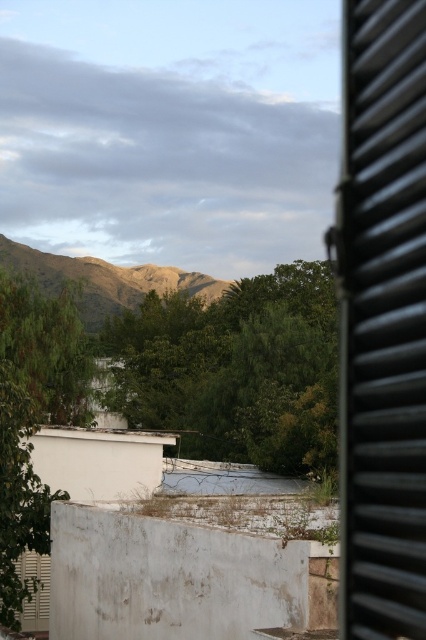
Question: Which object is closer to the camera taking this photo?

Choices:
 (A) black corrugated metal window at right
 (B) green leafy tree at center-left

Answer: (A)

Question: Which object is closer to the camera taking this photo?

Choices:
 (A) black corrugated metal window at right
 (B) brown textured mountain at center
 (C) green leafy tree at center

Answer: (A)

Question: From the image, what is the correct spatial relationship of black corrugated metal window at right in relation to green leafy tree at center-left?

Choices:
 (A) below
 (B) above

Answer: (B)

Question: Estimate the real-world distances between objects in this image. Which object is closer to the green leafy tree at center?

Choices:
 (A) green leafy tree at center-left
 (B) black corrugated metal window at right

Answer: (A)

Question: Is black corrugated metal window at right positioned behind green leafy tree at center-left?

Choices:
 (A) no
 (B) yes

Answer: (A)

Question: Is black corrugated metal window at right behind green leafy tree at center?

Choices:
 (A) yes
 (B) no

Answer: (B)